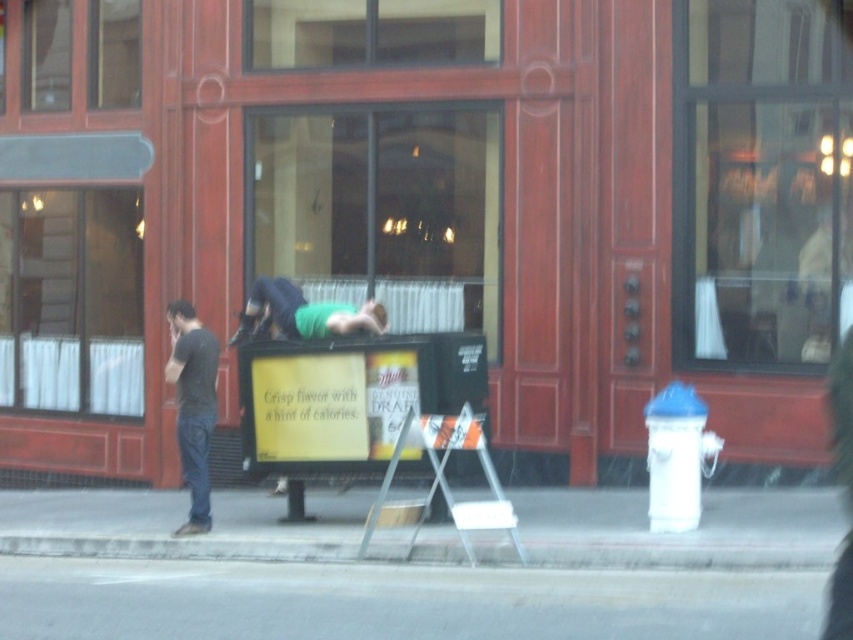
You are a photographer trying to capture a candid shot of both the black cotton shirt at left and the green matte shirt at center. Since you want to ensure both are fully visible in the frame, which subject should you position closer to the camera to avoid cropping?

The black cotton shirt at left is much taller than the green matte shirt at center. To ensure both are fully visible in the frame, position the black cotton shirt at left closer to the camera since it is taller and might require more space in the depth of the shot to avoid cropping.

You are a delivery person trying to place a package on the ground in the street scene. The package must be placed on the gray asphalt at lower center without covering the green matte shirt at center. Is this possible?

The gray asphalt at lower center is positioned under green matte shirt at center, meaning the shirt is covering the asphalt. Therefore, it is not possible to place the package on the gray asphalt at lower center without covering the green matte shirt at center.